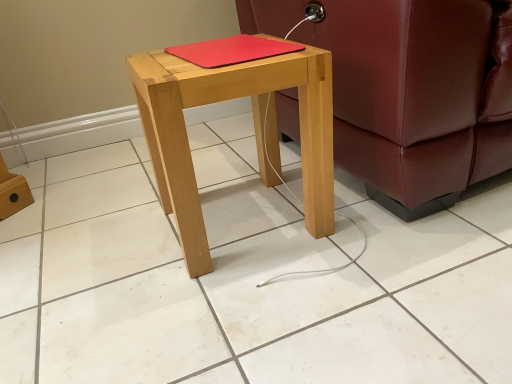
Question: Is the depth of leather couch at right less than that of red matte notebook at center?

Choices:
 (A) no
 (B) yes

Answer: (B)

Question: Can red matte notebook at center be found inside leather couch at right?

Choices:
 (A) no
 (B) yes

Answer: (A)

Question: Are leather couch at right and red matte notebook at center making contact?

Choices:
 (A) no
 (B) yes

Answer: (A)

Question: Is leather couch at right wider than red matte notebook at center?

Choices:
 (A) no
 (B) yes

Answer: (B)

Question: Considering the relative sizes of leather couch at right and red matte notebook at center in the image provided, is leather couch at right shorter than red matte notebook at center?

Choices:
 (A) yes
 (B) no

Answer: (B)

Question: Is leather couch at right positioned with its back to red matte notebook at center?

Choices:
 (A) yes
 (B) no

Answer: (B)

Question: Considering the relative sizes of natural wood stool at center and leather couch at right in the image provided, is natural wood stool at center wider than leather couch at right?

Choices:
 (A) yes
 (B) no

Answer: (B)

Question: Are natural wood stool at center and leather couch at right located far from each other?

Choices:
 (A) no
 (B) yes

Answer: (A)

Question: From a real-world perspective, is natural wood stool at center located higher than leather couch at right?

Choices:
 (A) no
 (B) yes

Answer: (A)

Question: Is natural wood stool at center to the right of leather couch at right from the viewer's perspective?

Choices:
 (A) no
 (B) yes

Answer: (A)

Question: Considering the relative sizes of natural wood stool at center and leather couch at right in the image provided, is natural wood stool at center bigger than leather couch at right?

Choices:
 (A) no
 (B) yes

Answer: (A)

Question: From the image's perspective, is natural wood stool at center above leather couch at right?

Choices:
 (A) no
 (B) yes

Answer: (A)

Question: From a real-world perspective, is leather couch at right on natural wood stool at center?

Choices:
 (A) yes
 (B) no

Answer: (A)